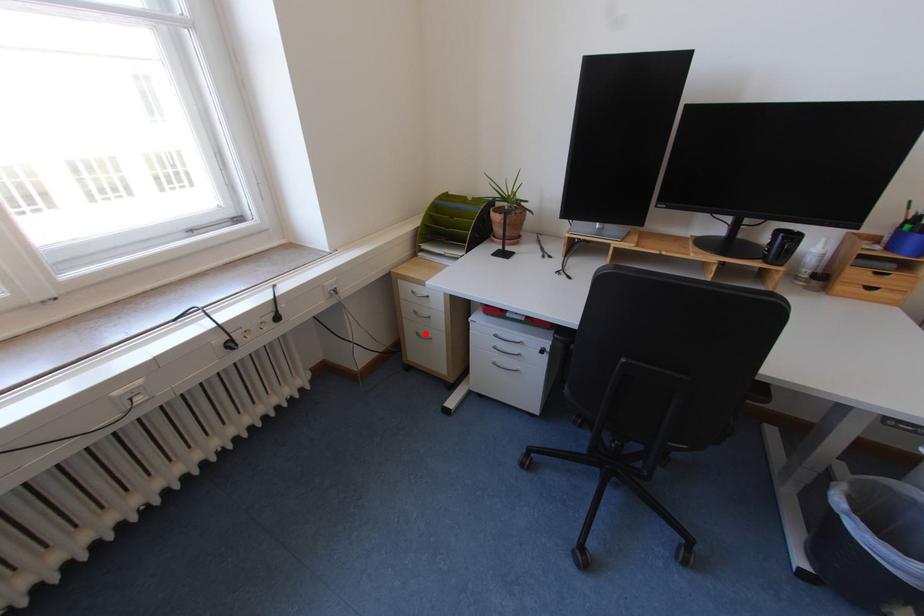
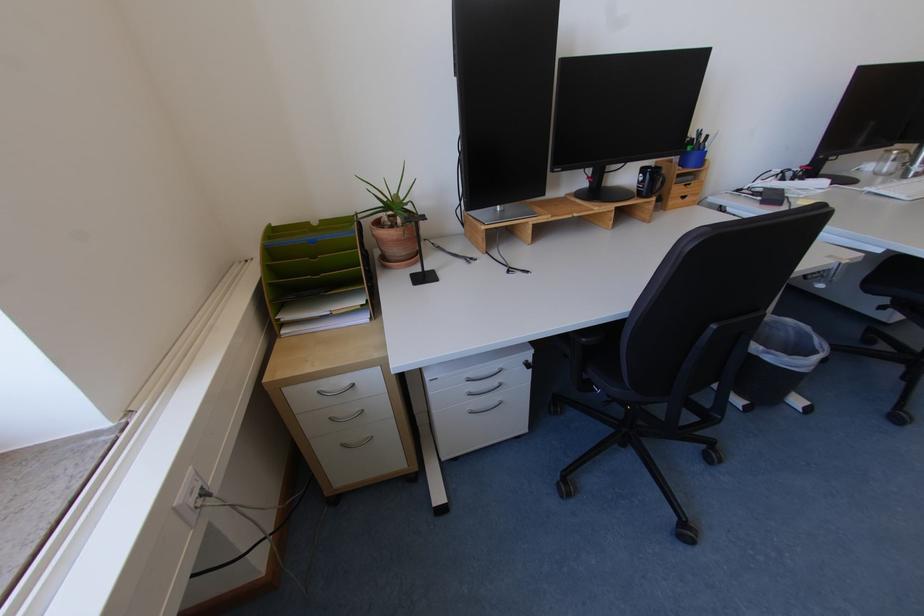
In the second image, find the point that corresponds to the highlighted location in the first image.

(350, 446)